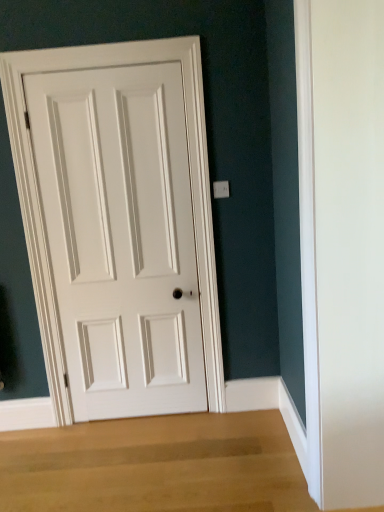
Find the location of `white matte door at center`. white matte door at center is located at coordinates (119, 236).

This screenshot has width=384, height=512. Describe the element at coordinates (119, 236) in the screenshot. I see `white matte door at center` at that location.

I want to click on white matte door at center, so click(119, 236).